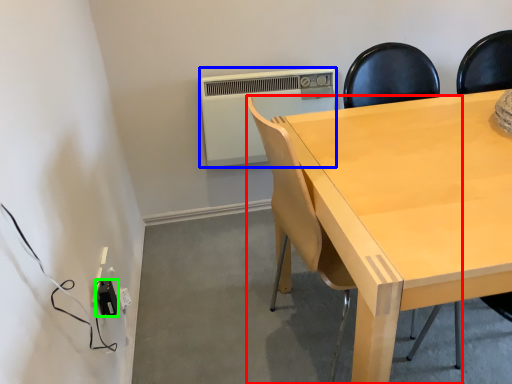
Question: Estimate the real-world distances between objects in this image. Which object is farther from chair (highlighted by a red box), air conditioning (highlighted by a blue box) or electric outlet (highlighted by a green box)?

Choices:
 (A) air conditioning
 (B) electric outlet

Answer: (A)